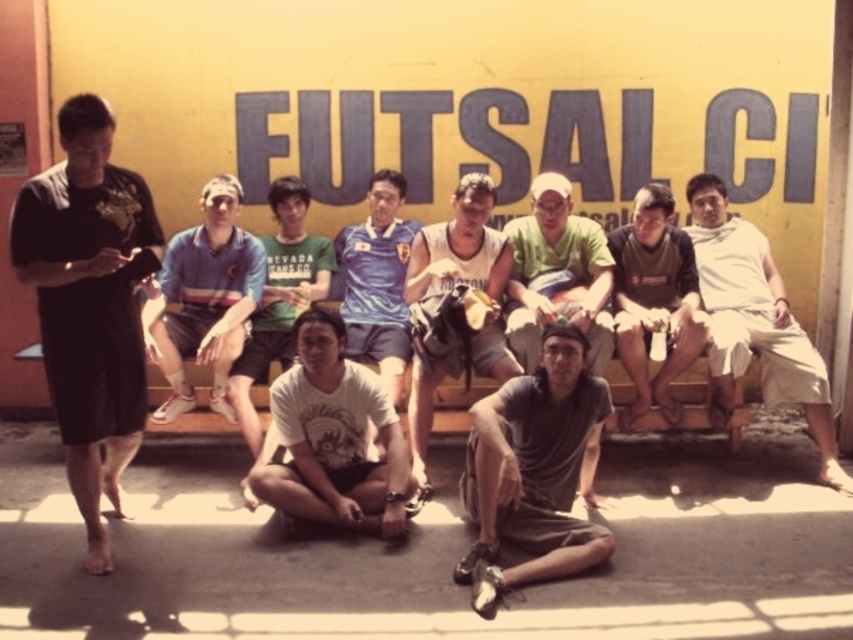
Question: Is dark green jersey at center bigger than blue jersey at center?

Choices:
 (A) yes
 (B) no

Answer: (B)

Question: Among these objects, which one is nearest to the camera?

Choices:
 (A) black matte shorts at left
 (B) blue striped jersey at center
 (C) light green fabric shirt at center
 (D) white cotton shirt at center

Answer: (A)

Question: Does light green fabric shirt at center have a greater width compared to white cotton t-shirt at center?

Choices:
 (A) yes
 (B) no

Answer: (A)

Question: Which object is the closest to the blue jersey at center?

Choices:
 (A) white cotton shirt at center
 (B) black matte shorts at left
 (C) dark green jersey at center

Answer: (C)

Question: Considering the relative positions of black matte shorts at left and white cotton shirt at center in the image provided, where is black matte shorts at left located with respect to white cotton shirt at center?

Choices:
 (A) below
 (B) above

Answer: (B)

Question: Which is nearer to the dark green jersey at center?

Choices:
 (A) white matte t-shirt at center
 (B) white jersey at center
 (C) black matte shorts at left
 (D) white cotton shirt at center

Answer: (D)